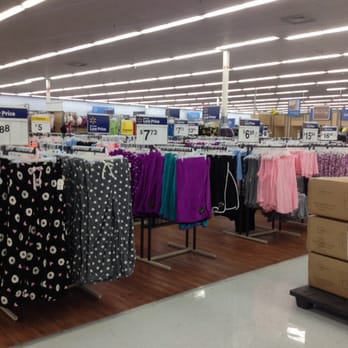
The image size is (348, 348). Find the location of `empty floor`. empty floor is located at coordinates (237, 322).